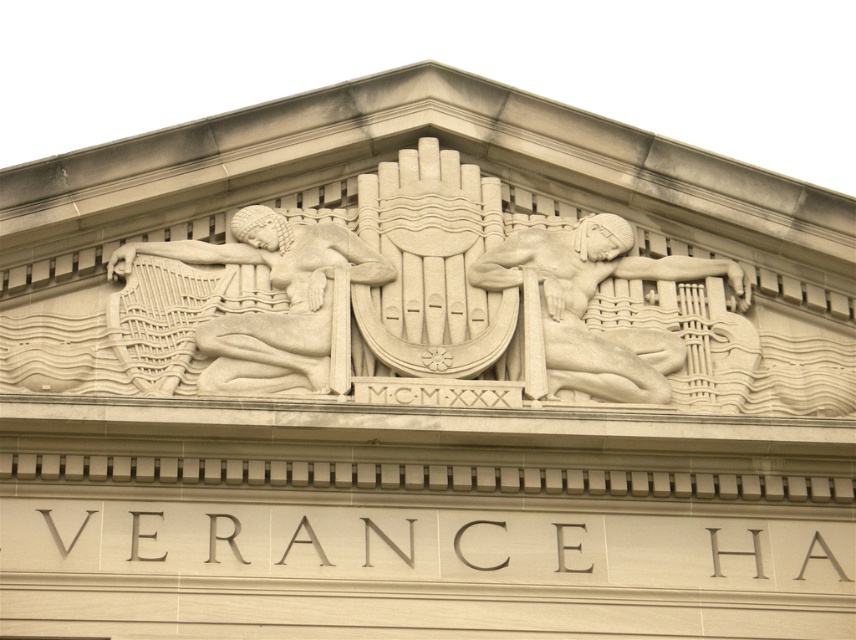
Who is positioned more to the right, white stone harp at center or white stone reclining figure at center?

From the viewer's perspective, white stone reclining figure at center appears more on the right side.

Between white stone harp at center and white stone reclining figure at center, which one has more height?

Standing taller between the two is white stone harp at center.

Between point (253, 355) and point (553, 266), which one is positioned in front?

Point (253, 355) is in front.

You are a GUI agent. You are given a task and a screenshot of the screen. Output one action in this format:
    pyautogui.click(x=<x>, y=<y>)
    Task: Click on the white stone harp at center
    Image resolution: width=856 pixels, height=640 pixels.
    Given the screenshot: What is the action you would take?
    pyautogui.click(x=276, y=310)